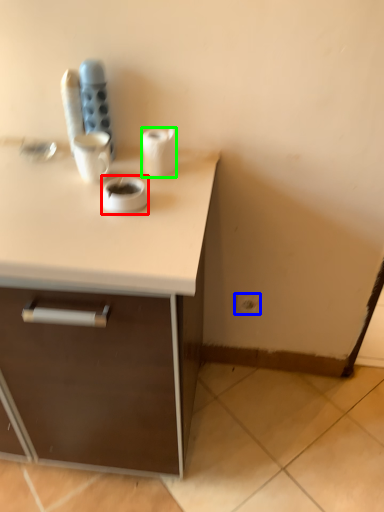
Question: Considering the real-world distances, which object is farthest from coffee (highlighted by a red box)? electric outlet (highlighted by a blue box) or paper towel (highlighted by a green box)?

Choices:
 (A) electric outlet
 (B) paper towel

Answer: (A)